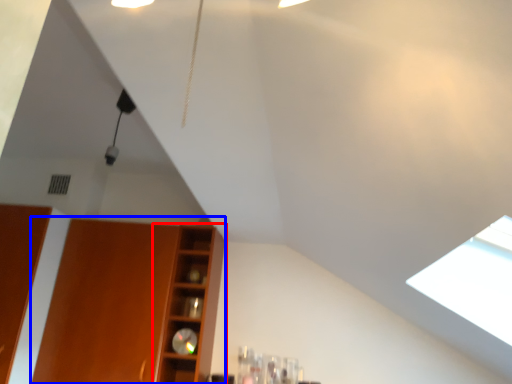
Question: Among these objects, which one is farthest to the camera, shelf (highlighted by a red box) or cabinetry (highlighted by a blue box)?

Choices:
 (A) shelf
 (B) cabinetry

Answer: (A)